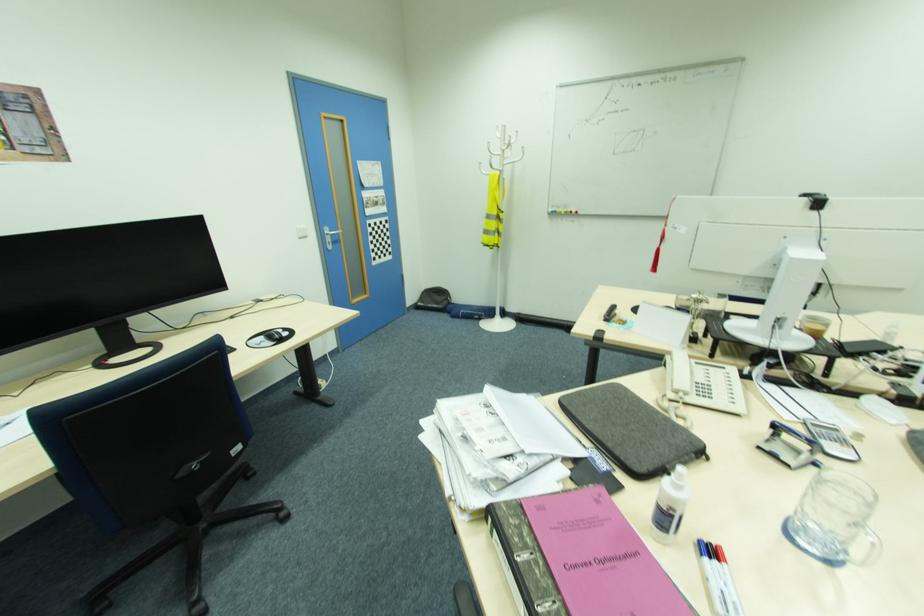
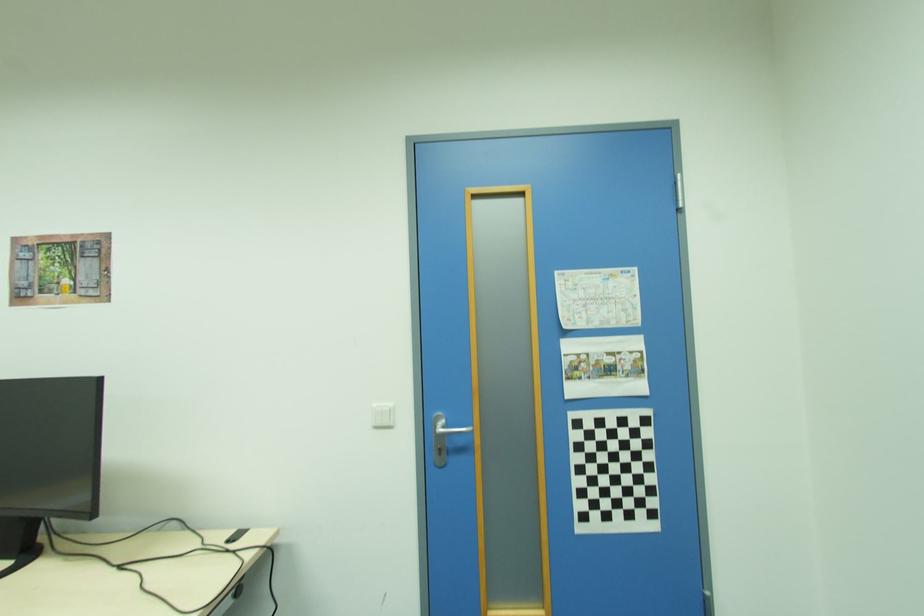
Find the pixel in the second image that matches point (310, 237) in the first image.

(394, 427)